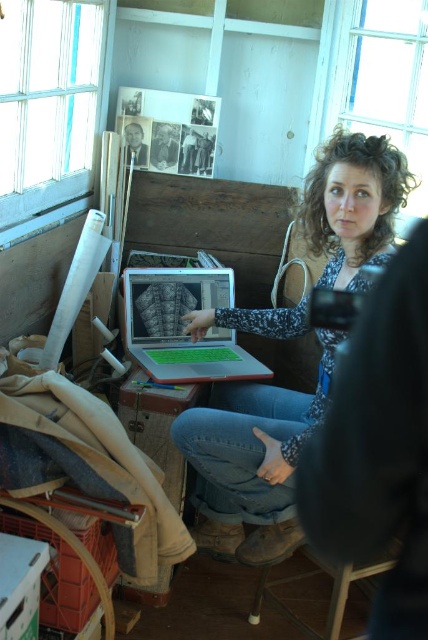
Question: Based on their relative distances, which object is nearer to the silver metallic laptop at center?

Choices:
 (A) matte gray sweater at center
 (B) matte black laptop at center
 (C) wooden stool at lower center

Answer: (A)

Question: Is matte gray sweater at center bigger than matte black laptop at center?

Choices:
 (A) no
 (B) yes

Answer: (B)

Question: Is matte gray sweater at center below black glossy portrait at upper left?

Choices:
 (A) yes
 (B) no

Answer: (A)

Question: Which of the following is the farthest from the observer?

Choices:
 (A) (139, 132)
 (B) (338, 150)

Answer: (A)

Question: Which of the following is the closest to the observer?

Choices:
 (A) (127, 140)
 (B) (336, 612)

Answer: (B)

Question: Does silver metallic laptop at center appear on the right side of wooden stool at lower center?

Choices:
 (A) yes
 (B) no

Answer: (B)